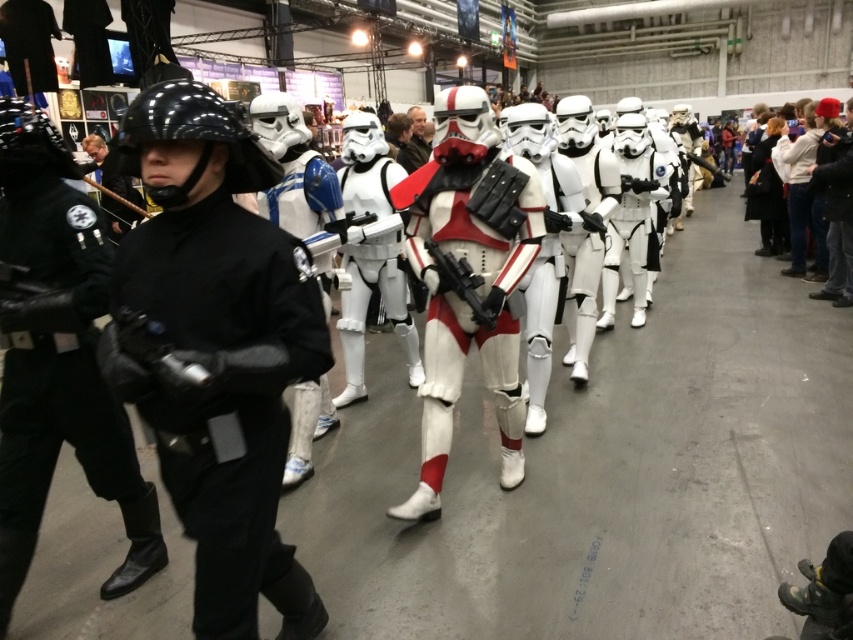
Question: Does black matte uniform at center have a smaller size compared to black matte helmet at left?

Choices:
 (A) no
 (B) yes

Answer: (A)

Question: Can you confirm if black matte helmet at left is positioned above white matte/soft plastic armor at center?

Choices:
 (A) no
 (B) yes

Answer: (A)

Question: Which of these objects is positioned closest to the white matte/soft plastic armor at center?

Choices:
 (A) white matte helmet at upper right
 (B) black matte helmet at left

Answer: (B)

Question: Based on their relative distances, which object is nearer to the black matte uniform at center?

Choices:
 (A) white matte helmet at upper right
 (B) black matte helmet at left
 (C) white matte/soft plastic armor at center

Answer: (B)

Question: Which object is positioned farthest from the white matte/soft plastic armor at center?

Choices:
 (A) black matte uniform at center
 (B) white matte helmet at upper right

Answer: (B)

Question: Does black matte uniform at center appear under black matte helmet at left?

Choices:
 (A) no
 (B) yes

Answer: (B)